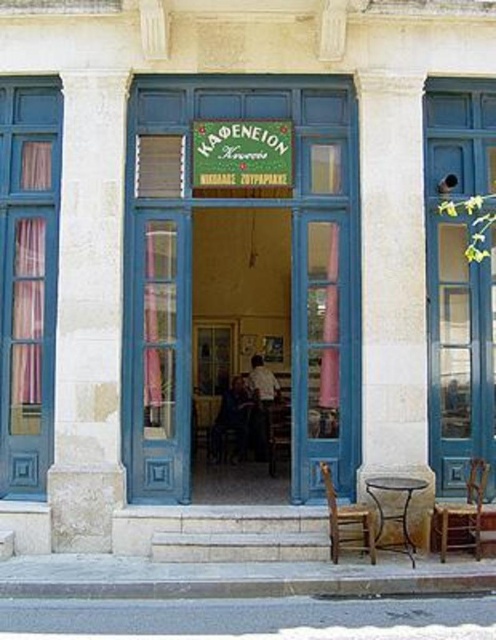
You are standing at the entrance of the Kafeneion coffee shop and notice two points marked on the facade. Which point is closer to you, the point at coordinate (386, 227) or the point at (452, 524)?

The point at coordinate (386, 227) is closer to you because it is further to the viewer than the point at (452, 524).